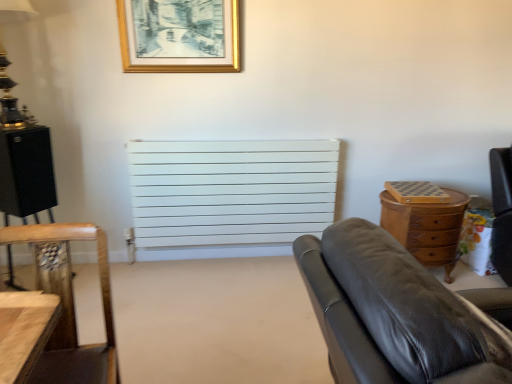
Question: From their relative heights in the image, would you say wooden chair at lower left is taller or shorter than gold metallic lamp at upper left?

Choices:
 (A) tall
 (B) short

Answer: (A)

Question: From the image's perspective, is wooden chair at lower left above or below gold metallic lamp at upper left?

Choices:
 (A) below
 (B) above

Answer: (A)

Question: Which object is the farthest from the gold metallic lamp at upper left?

Choices:
 (A) gold/golden frame at upper center
 (B) wooden chest of drawers at right
 (C) white matte radiator at center
 (D) black leather couch at right
 (E) wooden chair at lower left

Answer: (B)

Question: Considering the real-world distances, which object is closest to the black leather couch at right?

Choices:
 (A) gold/golden frame at upper center
 (B) wooden chair at lower left
 (C) wooden chest of drawers at right
 (D) white matte radiator at center
 (E) gold metallic lamp at upper left

Answer: (B)